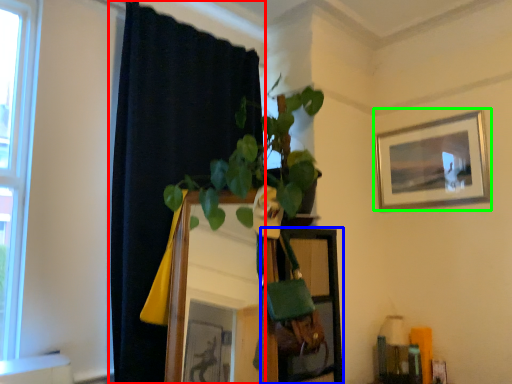
Question: Which object is the farthest from curtain (highlighted by a red box)? Choose among these: shelf (highlighted by a blue box) or picture frame (highlighted by a green box).

Choices:
 (A) shelf
 (B) picture frame

Answer: (B)